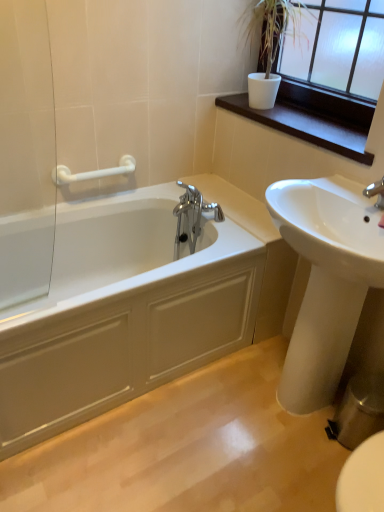
Question: Is dark wood window sill at upper right further to camera compared to dark brown wood at upper right?

Choices:
 (A) no
 (B) yes

Answer: (B)

Question: From a real-world perspective, is dark wood window sill at upper right on dark brown wood at upper right?

Choices:
 (A) no
 (B) yes

Answer: (A)

Question: Is dark wood window sill at upper right positioned with its back to dark brown wood at upper right?

Choices:
 (A) yes
 (B) no

Answer: (B)

Question: Does dark wood window sill at upper right lie in front of dark brown wood at upper right?

Choices:
 (A) yes
 (B) no

Answer: (B)

Question: From a real-world perspective, is dark wood window sill at upper right located beneath dark brown wood at upper right?

Choices:
 (A) no
 (B) yes

Answer: (B)

Question: Is dark wood window sill at upper right bigger than dark brown wood at upper right?

Choices:
 (A) yes
 (B) no

Answer: (B)

Question: Is white plastic grab bar at upper left positioned beyond the bounds of dark brown wood at upper right?

Choices:
 (A) yes
 (B) no

Answer: (A)

Question: Is white plastic grab bar at upper left further to the viewer compared to dark brown wood at upper right?

Choices:
 (A) no
 (B) yes

Answer: (B)

Question: Is white plastic grab bar at upper left at the right side of dark brown wood at upper right?

Choices:
 (A) no
 (B) yes

Answer: (A)

Question: From a real-world perspective, is white plastic grab bar at upper left positioned under dark brown wood at upper right based on gravity?

Choices:
 (A) no
 (B) yes

Answer: (B)

Question: Is white plastic grab bar at upper left next to dark brown wood at upper right?

Choices:
 (A) no
 (B) yes

Answer: (A)

Question: From a real-world perspective, does white plastic grab bar at upper left stand above dark brown wood at upper right?

Choices:
 (A) no
 (B) yes

Answer: (A)

Question: From a real-world perspective, is dark brown wood at upper right on white plastic grab bar at upper left?

Choices:
 (A) yes
 (B) no

Answer: (A)